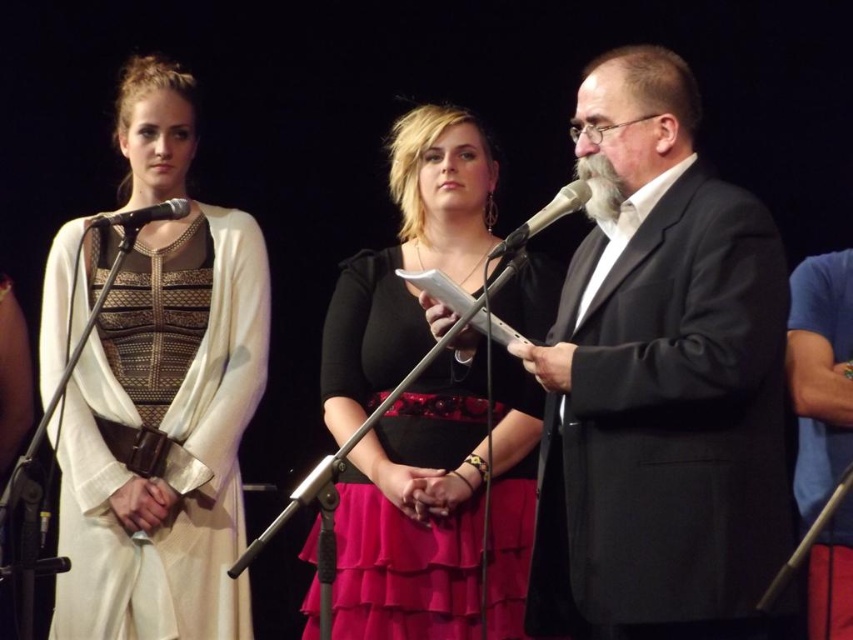
Question: Which point appears closest to the camera in this image?

Choices:
 (A) (537, 604)
 (B) (183, 212)
 (C) (578, 186)
 (D) (386, 348)

Answer: (C)

Question: Is matte white dress at left in front of black satin dress at center?

Choices:
 (A) no
 (B) yes

Answer: (A)

Question: Among these points, which one is farthest from the camera?

Choices:
 (A) (575, 202)
 (B) (97, 227)

Answer: (B)

Question: Which point is farther to the camera?

Choices:
 (A) black suit at center
 (B) matte white dress at left
 (C) metallic silver microphone at center
 (D) black matte microphone at upper left

Answer: (B)

Question: Can you confirm if matte white dress at left is wider than black satin dress at center?

Choices:
 (A) no
 (B) yes

Answer: (A)

Question: Is black suit at center to the right of matte white dress at left from the viewer's perspective?

Choices:
 (A) yes
 (B) no

Answer: (A)